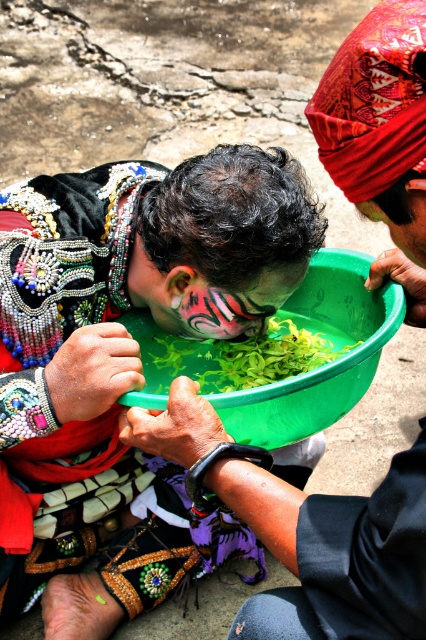
Question: Which point is closer to the camera taking this photo?

Choices:
 (A) (221, 332)
 (B) (377, 356)
 (C) (336, 346)
 (D) (126, 282)

Answer: (B)

Question: Observing the image, what is the correct spatial positioning of matte black face paint at center in reference to painted tiger face at center?

Choices:
 (A) below
 (B) above

Answer: (A)

Question: Which point is closer to the camera taking this photo?

Choices:
 (A) (158, 378)
 (B) (325, 364)
 (C) (394, 592)
 (D) (19, 340)

Answer: (C)

Question: Which of the following is the closest to the observer?

Choices:
 (A) matte green bowl at center
 (B) matte black face paint at center

Answer: (A)

Question: Is green leafy vegetable at center above painted tiger face at center?

Choices:
 (A) yes
 (B) no

Answer: (B)

Question: Does matte green bowl at center have a lesser width compared to green leafy vegetable at center?

Choices:
 (A) no
 (B) yes

Answer: (B)